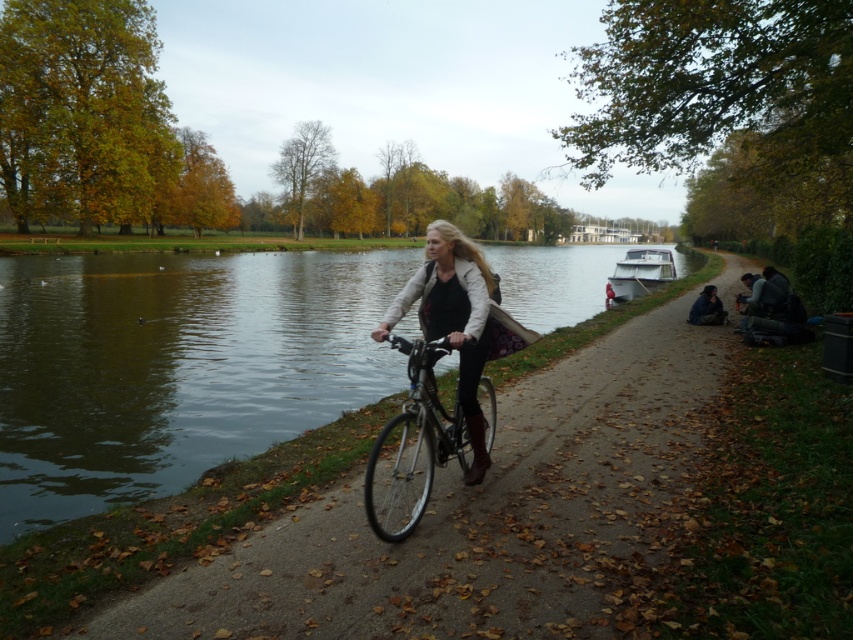
Who is more distant from viewer, (469,433) or (648,278)?

The point (648,278) is more distant.

From the picture: Who is more forward, (x=428, y=275) or (x=625, y=260)?

Point (x=428, y=275)

Is point (469, 353) positioned in front of point (648, 257)?

Yes, it is.

Where is `matte black jacket at center`? matte black jacket at center is located at coordinates (453, 320).

Is clear water at center thinner than dark blue jeans at right?

In fact, clear water at center might be wider than dark blue jeans at right.

Is point (71, 417) behind point (708, 317)?

No, (71, 417) is in front of (708, 317).

Describe the element at coordinates (175, 365) in the screenshot. I see `clear water at center` at that location.

Find the location of a particular element. The height and width of the screenshot is (640, 853). clear water at center is located at coordinates (175, 365).

Which of these two, clear water at center or shiny black bicycle at center, stands shorter?

shiny black bicycle at center

Does point (312, 268) lie behind point (402, 429)?

That is True.

The width and height of the screenshot is (853, 640). Find the location of `clear water at center`. clear water at center is located at coordinates (175, 365).